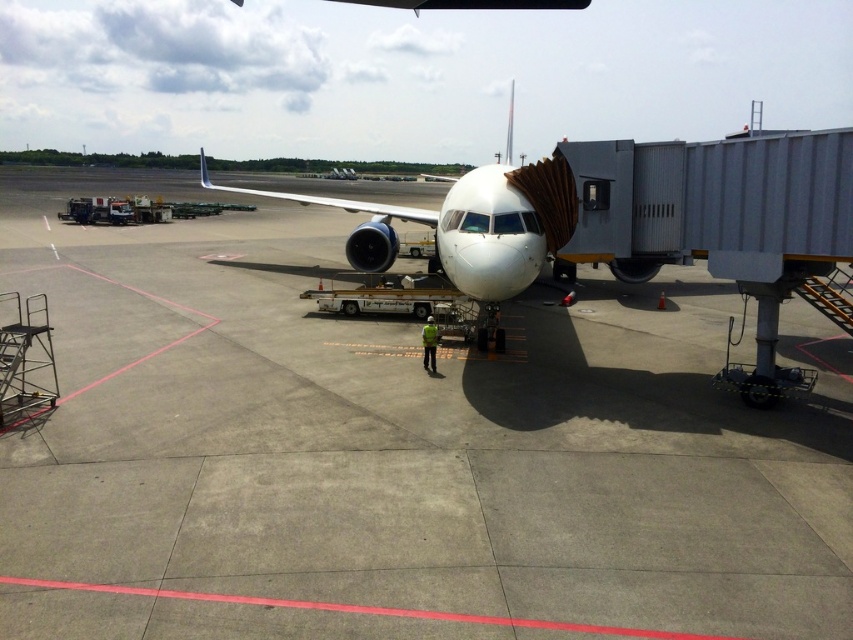
What is the exact coordinate of the gray concrete tarmac at center?

The gray concrete tarmac at center is located at point (x=396, y=451).

You are a pilot who needs to ensure the gray concrete tarmac at center can accommodate the white matte airplane at center. Based on the scene, can the airplane fit on the tarmac?

The gray concrete tarmac at center has a smaller size compared to white matte airplane at center, so the airplane cannot fit on the tarmac.

You are a pilot who needs to ensure the runway is wide enough for your airplane. Based on the scene, can you confirm if the gray concrete tarmac at center is wider than the white matte airplane at center?

The gray concrete tarmac at center is wider than the white matte airplane at center, so yes, the runway is wide enough for the airplane.